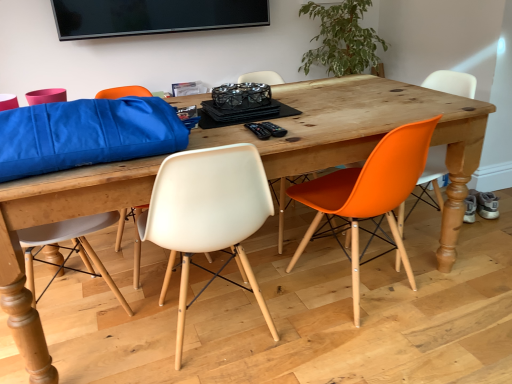
I want to click on vacant space situated on the left part of black plastic remote control at center, the 1th remote control viewed from the right, so click(224, 135).